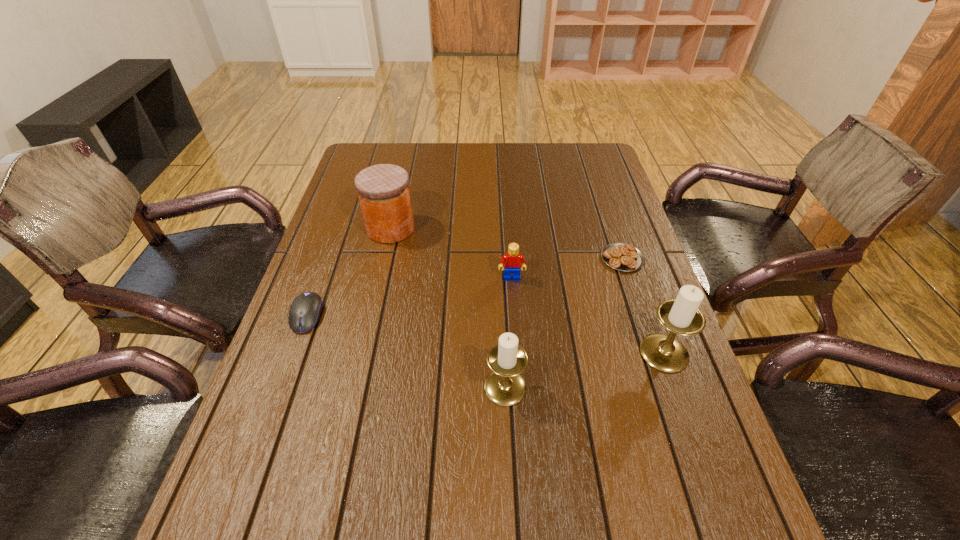
Please point a free position for a candle holder on the left. Please provide its 2D coordinates. Your answer should be formatted as a tuple, i.e. [(x, y)], where the tuple contains the x and y coordinates of a point satisfying the conditions above.

[(324, 427)]